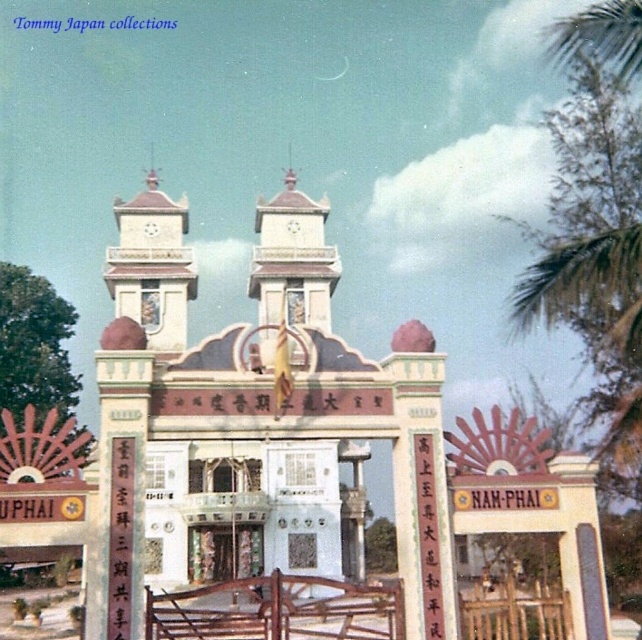
You are a tourist standing in front of this traditional building and want to take a photo that includes both the white stone clock tower at upper center and the white stone tower at center. Which tower should you focus on first to ensure both are in frame?

The white stone clock tower at upper center is much taller than the white stone tower at center, so you should focus on the white stone clock tower at upper center first to ensure both are in frame.